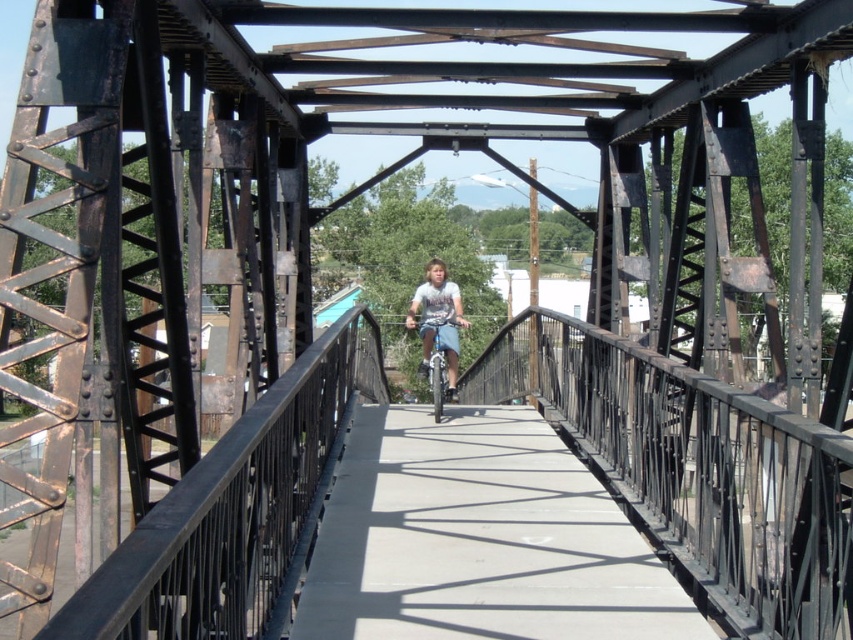
Does white concrete path at center have a lesser height compared to light blue denim shorts at center?

Indeed, white concrete path at center has a lesser height compared to light blue denim shorts at center.

Can you confirm if white concrete path at center is taller than light blue denim shorts at center?

In fact, white concrete path at center may be shorter than light blue denim shorts at center.

You are a GUI agent. You are given a task and a screenshot of the screen. Output one action in this format:
    pyautogui.click(x=<x>, y=<y>)
    Task: Click on the white concrete path at center
    
    Given the screenshot: What is the action you would take?
    pyautogui.click(x=479, y=540)